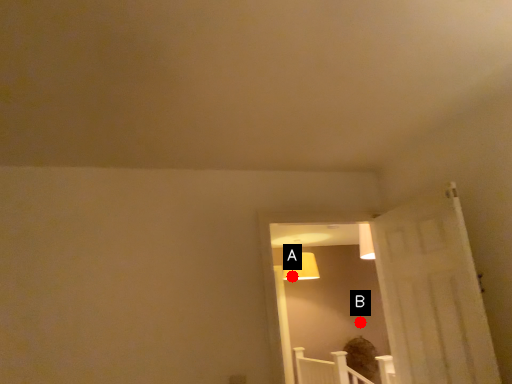
Question: Two points are circled on the image, labeled by A and B beside each circle. Which point is farther from the camera taking this photo?

Choices:
 (A) A is further
 (B) B is further

Answer: (A)